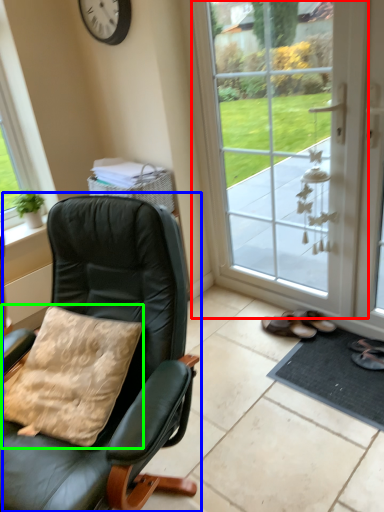
Question: Considering the real-world distances, which object is farthest from door (highlighted by a red box)? chair (highlighted by a blue box) or pillow (highlighted by a green box)?

Choices:
 (A) chair
 (B) pillow

Answer: (B)